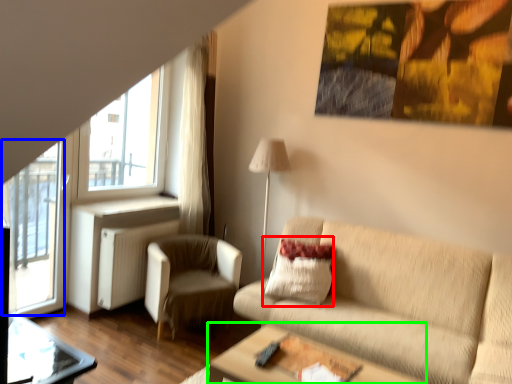
Question: Estimate the real-world distances between objects in this image. Which object is closer to pillow (highlighted by a red box), screen door (highlighted by a blue box) or table (highlighted by a green box)?

Choices:
 (A) screen door
 (B) table

Answer: (B)